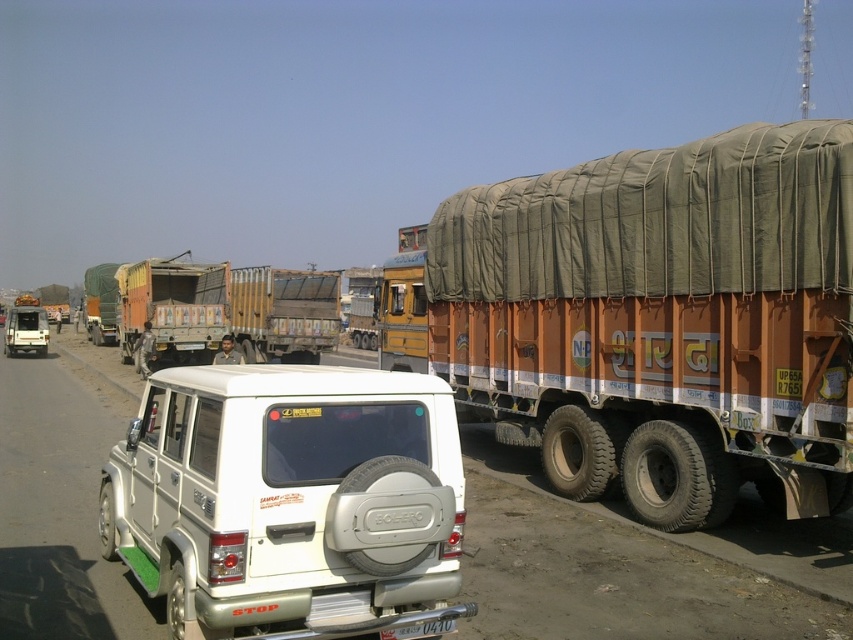
Between brown canvas trailer truck at right and white plastic license plate at center, which one appears on the right side from the viewer's perspective?

Positioned to the right is brown canvas trailer truck at right.

Is brown canvas trailer truck at right below white plastic license plate at center?

No.

You are a GUI agent. You are given a task and a screenshot of the screen. Output one action in this format:
    pyautogui.click(x=<x>, y=<y>)
    Task: Click on the brown canvas trailer truck at right
    This screenshot has width=853, height=640.
    Given the screenshot: What is the action you would take?
    pyautogui.click(x=660, y=317)

In order to click on brown canvas trailer truck at right in this screenshot , I will do `click(660, 317)`.